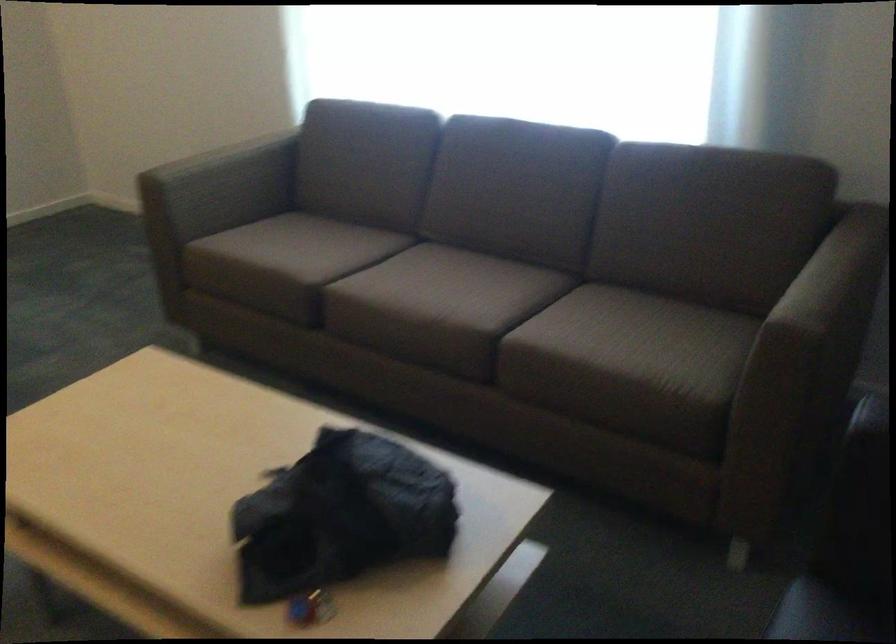
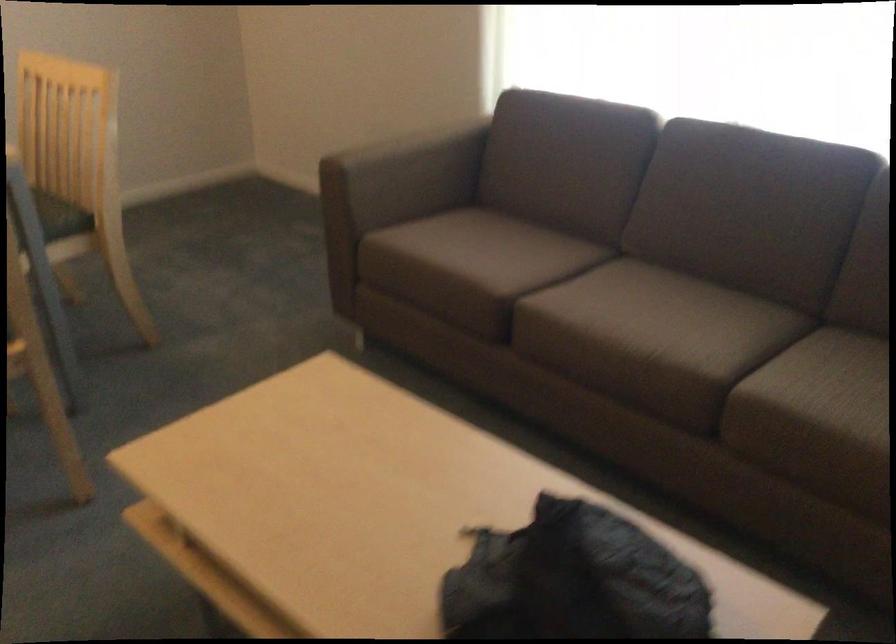
Locate, in the second image, the point that corresponds to point (496, 321) in the first image.

(726, 368)